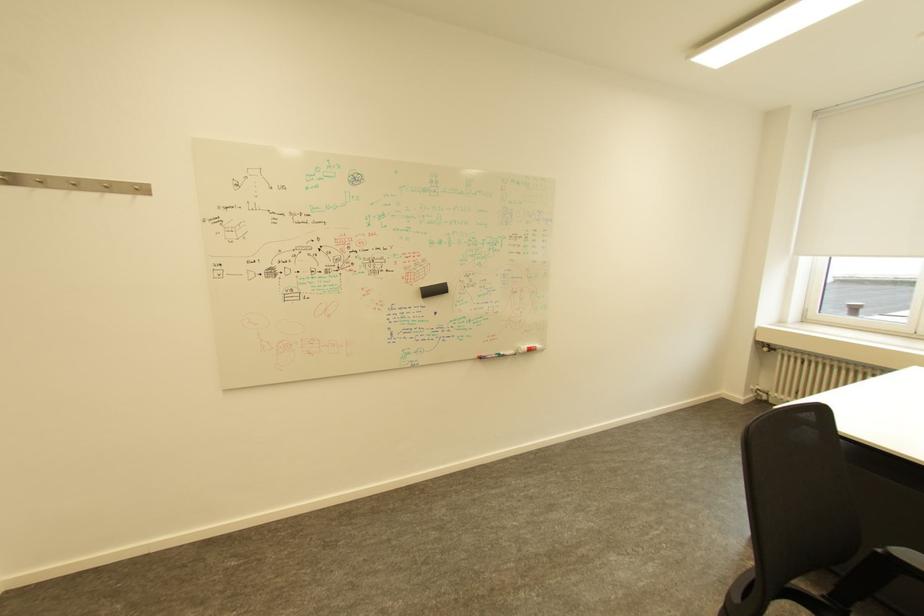
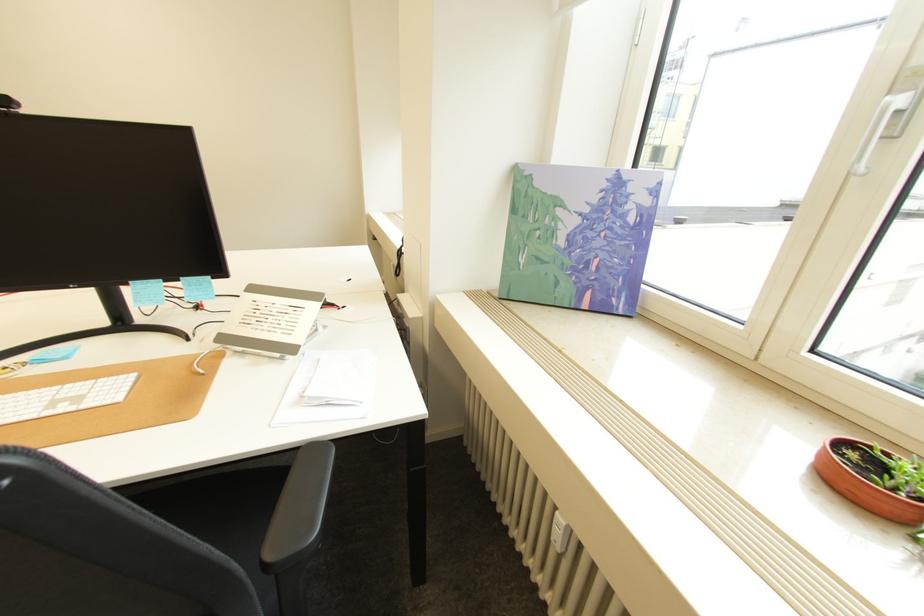
Question: The images are taken continuously from a first-person perspective. In which direction are you moving?

Choices:
 (A) Left
 (B) Right
 (C) Forward
 (D) Backward

Answer: (B)